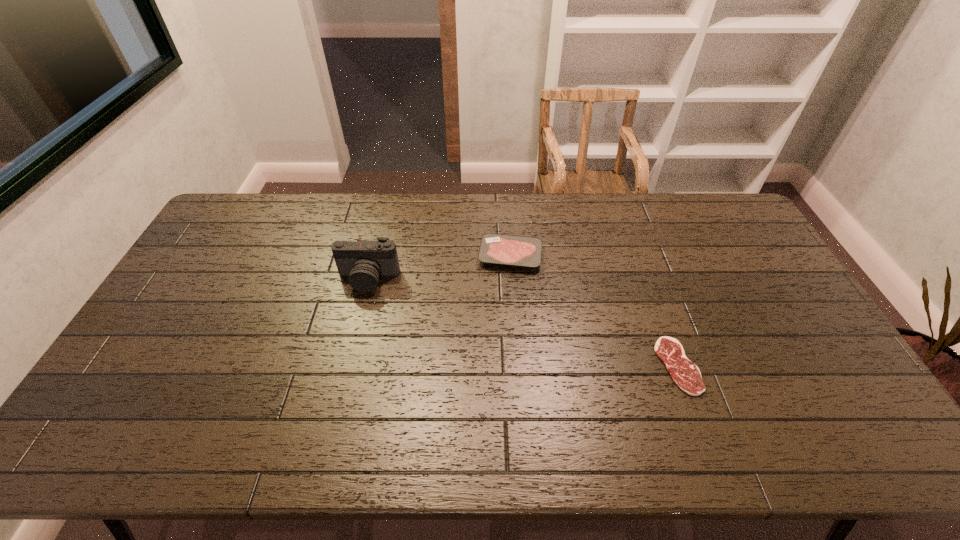
This screenshot has height=540, width=960. Find the location of `vacant space that satisfies the following two spatial constraints: 1. at the lens of the shorter steak; 2. on the right side of the camera`. vacant space that satisfies the following two spatial constraints: 1. at the lens of the shorter steak; 2. on the right side of the camera is located at coordinates (348, 366).

Where is `blank area in the image that satisfies the following two spatial constraints: 1. at the lens of the camera; 2. on the left side of the right steak`? The width and height of the screenshot is (960, 540). blank area in the image that satisfies the following two spatial constraints: 1. at the lens of the camera; 2. on the left side of the right steak is located at coordinates (348, 366).

Identify the location of free location that satisfies the following two spatial constraints: 1. at the lens of the shortest object; 2. on the right side of the leftmost object. The width and height of the screenshot is (960, 540). (348, 366).

The height and width of the screenshot is (540, 960). Find the location of `vacant area that satisfies the following two spatial constraints: 1. at the lens of the shortest object; 2. on the left side of the camera`. vacant area that satisfies the following two spatial constraints: 1. at the lens of the shortest object; 2. on the left side of the camera is located at coordinates (348, 366).

Image resolution: width=960 pixels, height=540 pixels. Find the location of `vacant space that satisfies the following two spatial constraints: 1. at the lens of the camera; 2. on the left side of the shorter steak`. vacant space that satisfies the following two spatial constraints: 1. at the lens of the camera; 2. on the left side of the shorter steak is located at coordinates (348, 366).